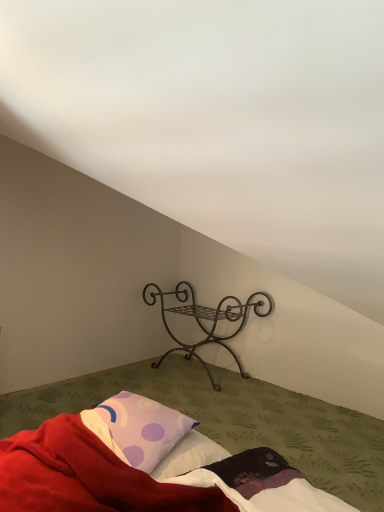
Question: Can you confirm if purple dotted pillow at lower left is wider than dark brown wrought iron stand at center?

Choices:
 (A) yes
 (B) no

Answer: (B)

Question: Does purple dotted pillow at lower left have a larger size compared to dark brown wrought iron stand at center?

Choices:
 (A) yes
 (B) no

Answer: (B)

Question: Is purple dotted pillow at lower left aimed at dark brown wrought iron stand at center?

Choices:
 (A) yes
 (B) no

Answer: (B)

Question: Is purple dotted pillow at lower left behind dark brown wrought iron stand at center?

Choices:
 (A) no
 (B) yes

Answer: (A)

Question: Is purple dotted pillow at lower left positioned with its back to dark brown wrought iron stand at center?

Choices:
 (A) no
 (B) yes

Answer: (A)

Question: From a real-world perspective, is purple dotted pillow at lower left above or below soft cotton bed at center?

Choices:
 (A) above
 (B) below

Answer: (A)

Question: Is purple dotted pillow at lower left bigger or smaller than soft cotton bed at center?

Choices:
 (A) big
 (B) small

Answer: (B)

Question: In the image, is purple dotted pillow at lower left positioned in front of or behind soft cotton bed at center?

Choices:
 (A) behind
 (B) front

Answer: (A)

Question: Is point (124, 455) positioned closer to the camera than point (180, 471)?

Choices:
 (A) closer
 (B) farther

Answer: (B)

Question: From a real-world perspective, is dark brown wrought iron stand at center physically located above or below soft cotton bed at center?

Choices:
 (A) above
 (B) below

Answer: (A)

Question: Considering the positions of dark brown wrought iron stand at center and soft cotton bed at center in the image, is dark brown wrought iron stand at center taller or shorter than soft cotton bed at center?

Choices:
 (A) short
 (B) tall

Answer: (B)

Question: Is point (221, 342) closer or farther from the camera than point (167, 439)?

Choices:
 (A) farther
 (B) closer

Answer: (A)

Question: In terms of width, does dark brown wrought iron stand at center look wider or thinner when compared to soft cotton bed at center?

Choices:
 (A) wide
 (B) thin

Answer: (B)

Question: From the image's perspective, is purple dotted pillow at lower left located above or below dark brown wrought iron stand at center?

Choices:
 (A) below
 (B) above

Answer: (A)

Question: In terms of height, does purple dotted pillow at lower left look taller or shorter compared to dark brown wrought iron stand at center?

Choices:
 (A) tall
 (B) short

Answer: (B)